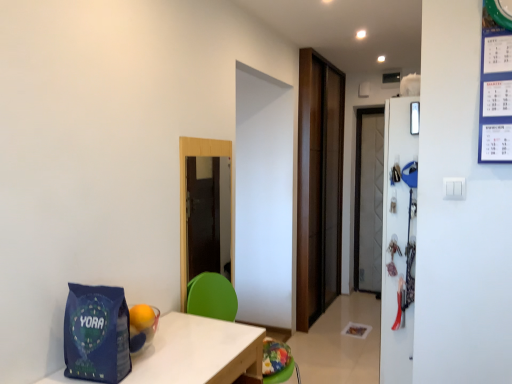
You are a GUI agent. You are given a task and a screenshot of the screen. Output one action in this format:
    pyautogui.click(x=<x>, y=<y>)
    Task: Click on the unoccupied region to the right of blue matte gift bag at lower left
    
    Given the screenshot: What is the action you would take?
    pyautogui.click(x=164, y=367)